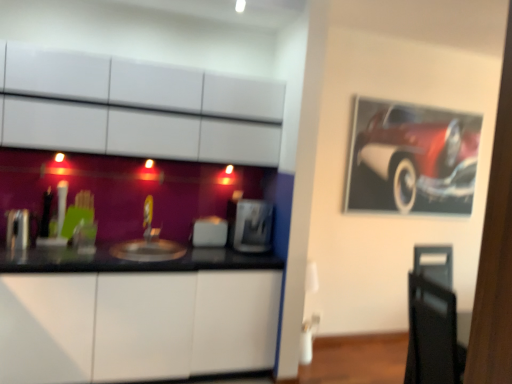
Question: From their relative heights in the image, would you say matte silver sink at center is taller or shorter than white glossy cabinet at lower left, the second cabinetry when ordered from top to bottom?

Choices:
 (A) tall
 (B) short

Answer: (B)

Question: Is matte silver sink at center in front of or behind white glossy cabinet at lower left, which is the 1th cabinetry from bottom to top, in the image?

Choices:
 (A) front
 (B) behind

Answer: (B)

Question: Estimate the real-world distances between objects in this image. Which object is farther from the satin silver toaster at center, which ranks as the 3th appliance in left-to-right order?

Choices:
 (A) white glossy cabinet at lower left, the second cabinetry when ordered from top to bottom
 (B) shiny red car at upper right
 (C) white glossy cabinets at upper center, which ranks as the first cabinetry in top-to-bottom order
 (D) satin silver toaster at left, the first appliance from the front
 (E) matte silver sink at center

Answer: (D)

Question: Estimate the real-world distances between objects in this image. Which object is farther from the satin silver toaster at center, placed as the 1th appliance when sorted from back to front?

Choices:
 (A) matte silver sink at center
 (B) satin silver toaster at center, the second appliance positioned from the back
 (C) white glossy cabinet at lower left, the second cabinetry when ordered from top to bottom
 (D) shiny red car at upper right
 (E) white glossy cabinets at upper center, the 2th cabinetry in the bottom-to-top sequence

Answer: (D)